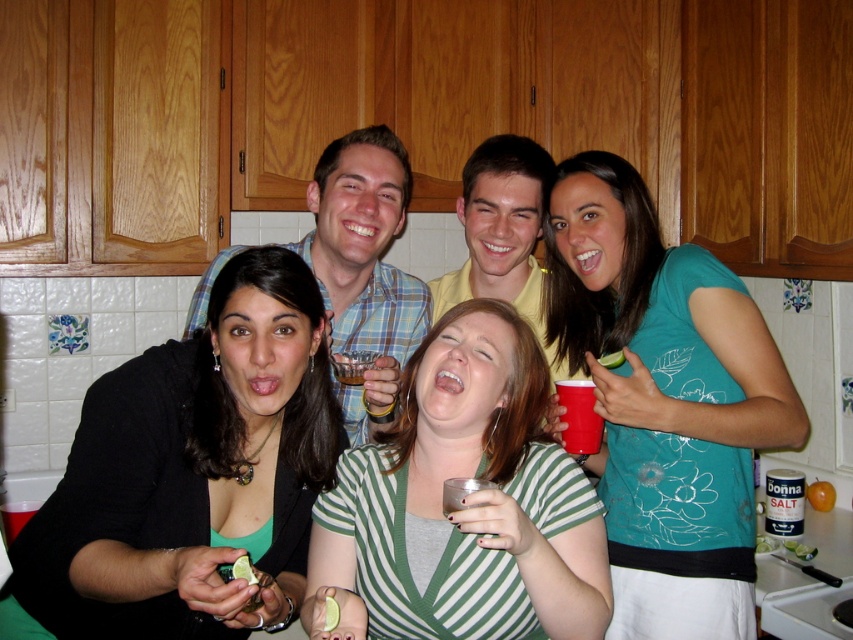
How much distance is there between green striped shirt at center and plaid shirt at center?

The distance of green striped shirt at center from plaid shirt at center is 13.57 inches.

Measure the distance between green striped shirt at center and camera.

green striped shirt at center is 3.38 feet away from camera.

Does point (426, 528) come closer to viewer compared to point (424, 288)?

That is True.

Locate an element on the screen. The image size is (853, 640). green striped shirt at center is located at coordinates (466, 506).

Is green striped shirt at center to the left of yellow cotton shirt at center from the viewer's perspective?

Yes, green striped shirt at center is to the left of yellow cotton shirt at center.

Who is lower down, green striped shirt at center or yellow cotton shirt at center?

green striped shirt at center is lower down.

Which is in front, point (550, 448) or point (495, 250)?

Point (550, 448) is in front.

Image resolution: width=853 pixels, height=640 pixels. I want to click on green striped shirt at center, so click(x=466, y=506).

Consider the image. Who is more forward, (804, 412) or (26, 592)?

Point (26, 592) is more forward.

Is point (643, 264) behind point (253, 282)?

Yes, point (643, 264) is farther from viewer.

Locate an element on the screen. The image size is (853, 640). green printed shirt at upper right is located at coordinates (665, 401).